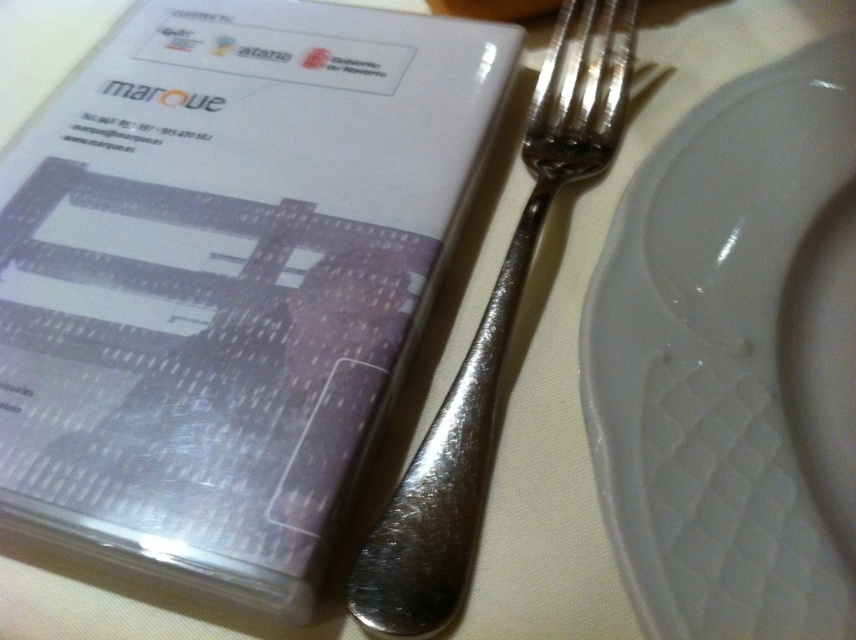
Where is the white glossy platter at center located in the image?

The white glossy platter at center is located at point [734,362].

You are a server in a restaurant. You need to place a napkin between the white glossy platter at center and the polished silver fork at center. The napkin is 8 inches wide. Can the napkin fit between them?

The distance between the white glossy platter at center and the polished silver fork at center is 9.17 inches. Since the napkin is 8 inches wide, it can fit between them with some space to spare.